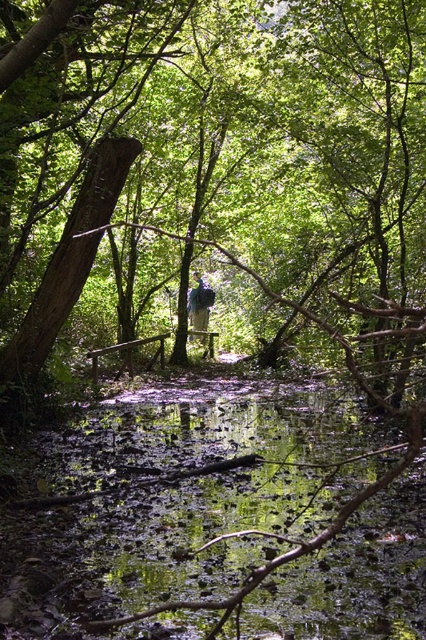
Between smooth brown tree trunk at center and green mossy water at center, which one is positioned lower?

green mossy water at center

The width and height of the screenshot is (426, 640). What do you see at coordinates (230, 173) in the screenshot?
I see `smooth brown tree trunk at center` at bounding box center [230, 173].

You are a GUI agent. You are given a task and a screenshot of the screen. Output one action in this format:
    pyautogui.click(x=<x>, y=<y>)
    Task: Click on the smooth brown tree trunk at center
    The width and height of the screenshot is (426, 640).
    Given the screenshot: What is the action you would take?
    pyautogui.click(x=230, y=173)

Is point (298, 589) closer to viewer compared to point (199, 289)?

Yes, it is in front of point (199, 289).

You are a GUI agent. You are given a task and a screenshot of the screen. Output one action in this format:
    pyautogui.click(x=<x>, y=<y>)
    Task: Click on the green mossy water at center
    This screenshot has height=640, width=426.
    Given the screenshot: What is the action you would take?
    pyautogui.click(x=216, y=516)

Can you confirm if smooth brown tree trunk at center is smaller than blue fabric backpack at center?

No, smooth brown tree trunk at center is not smaller than blue fabric backpack at center.

Does point (368, 58) come closer to viewer compared to point (210, 294)?

Yes, it is.

I want to click on smooth brown tree trunk at center, so click(x=230, y=173).